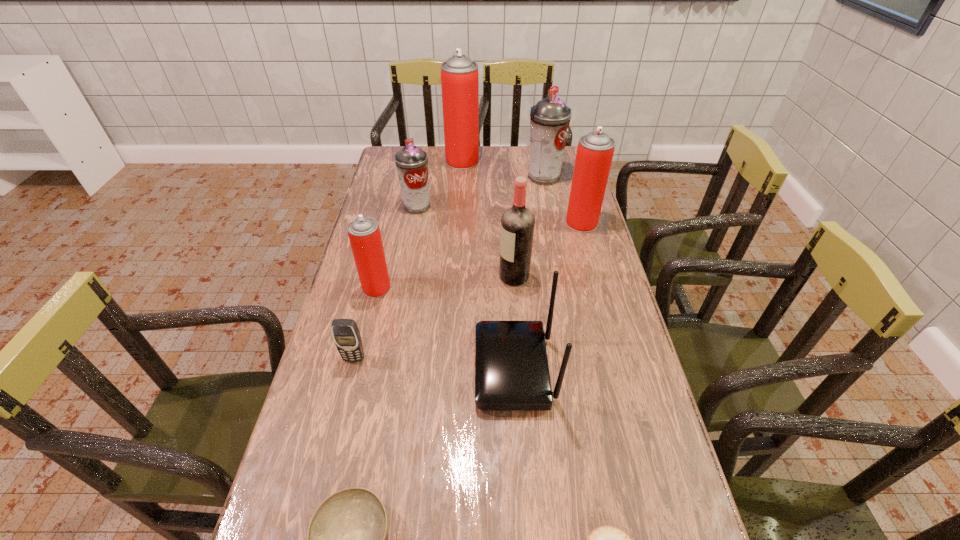
Identify the location of the tallest aerosol can. (459, 74).

Identify the location of the biggest red aerosol can. This screenshot has width=960, height=540. (459, 74).

Identify the location of the farther gray aerosol can. This screenshot has width=960, height=540. (549, 119).

Locate an element on the screen. The height and width of the screenshot is (540, 960). the bigger gray aerosol can is located at coordinates (549, 119).

Where is `the second biggest red aerosol can`? This screenshot has width=960, height=540. the second biggest red aerosol can is located at coordinates (595, 150).

Image resolution: width=960 pixels, height=540 pixels. I want to click on the second nearest red aerosol can, so click(595, 150).

What are the coordinates of `liquor` in the screenshot? It's located at (517, 223).

Find the location of a particular element. the nearest red aerosol can is located at coordinates (364, 234).

Find the location of a particular element. This screenshot has width=960, height=540. the nearest aerosol can is located at coordinates (364, 234).

You are a GUI agent. You are given a task and a screenshot of the screen. Output one action in this format:
    pyautogui.click(x=<x>, y=<y>)
    Task: Click on the nearer gray aerosol can
    The width and height of the screenshot is (960, 540).
    Given the screenshot: What is the action you would take?
    pyautogui.click(x=411, y=161)